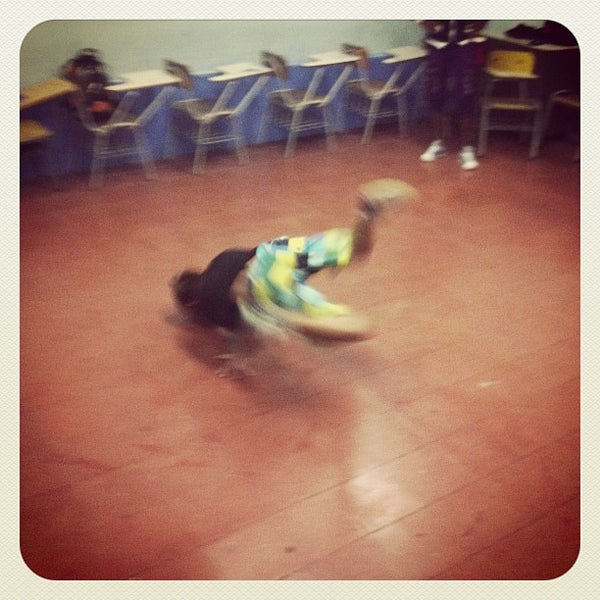
The height and width of the screenshot is (600, 600). I want to click on desk baskets, so click(119, 150), click(216, 133), click(308, 124), click(383, 110), click(506, 128).